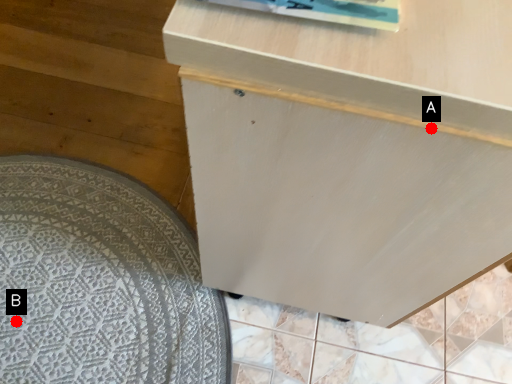
Question: Two points are circled on the image, labeled by A and B beside each circle. Which of the following is the closest to the observer?

Choices:
 (A) A is closer
 (B) B is closer

Answer: (A)